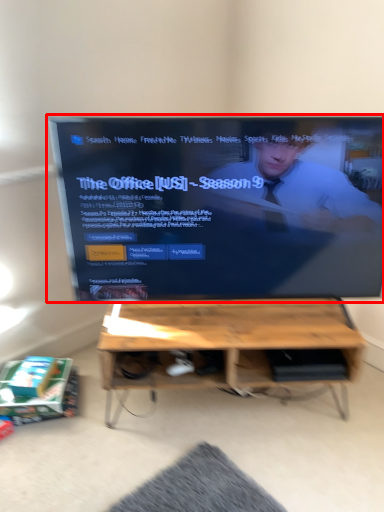
Question: From the image's perspective, what is the correct spatial relationship of television (annotated by the red box) in relation to table?

Choices:
 (A) below
 (B) above

Answer: (B)